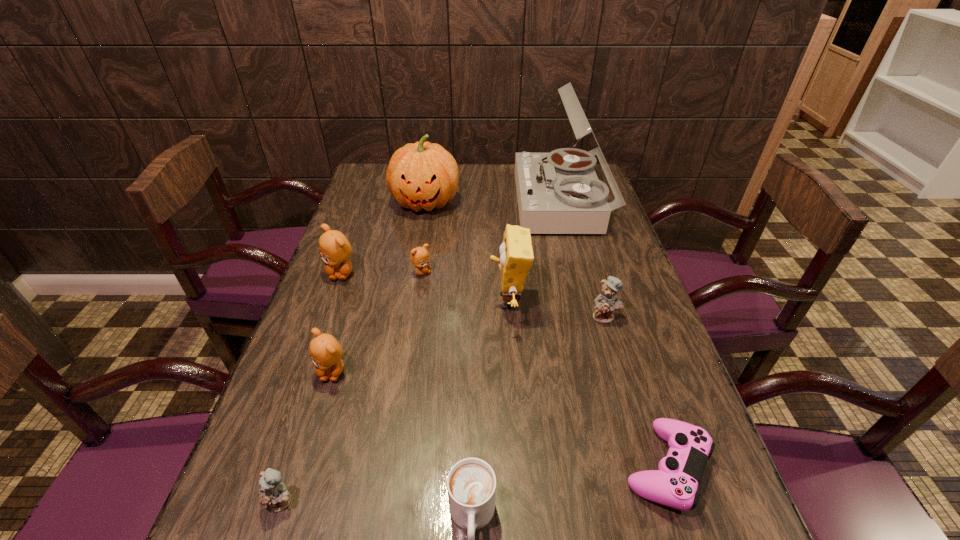
At what (x,y) coordinates should I click in order to perform the action: click on the tallest object. Please return your answer as a coordinate pair (x, y). This screenshot has width=960, height=540. Looking at the image, I should click on point(559,192).

You are a GUI agent. You are given a task and a screenshot of the screen. Output one action in this format:
    pyautogui.click(x=<x>, y=<y>)
    Task: Click on the record player
    
    Given the screenshot: What is the action you would take?
    pyautogui.click(x=559, y=192)

What are the coordinates of `pumpkin` in the screenshot? It's located at (424, 175).

This screenshot has width=960, height=540. I want to click on the second tallest object, so click(424, 175).

Locate an element on the screen. The width and height of the screenshot is (960, 540). sponge is located at coordinates (516, 250).

Where is `the seventh shortest object`? the seventh shortest object is located at coordinates (334, 248).

Where is `the biggest brown teddy bear`? The height and width of the screenshot is (540, 960). the biggest brown teddy bear is located at coordinates (334, 248).

Locate an element on the screen. This screenshot has height=540, width=960. the third nearest teddy bear is located at coordinates point(605,303).

This screenshot has width=960, height=540. Identify the location of the bigger blue teddy bear. (605, 303).

Identify the location of the seventh farthest object. The height and width of the screenshot is (540, 960). (325, 351).